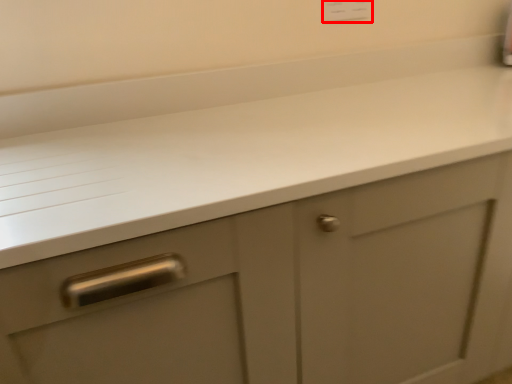
Question: Observing the image, what is the correct spatial positioning of electric outlet (annotated by the red box) in reference to countertop?

Choices:
 (A) left
 (B) right

Answer: (A)